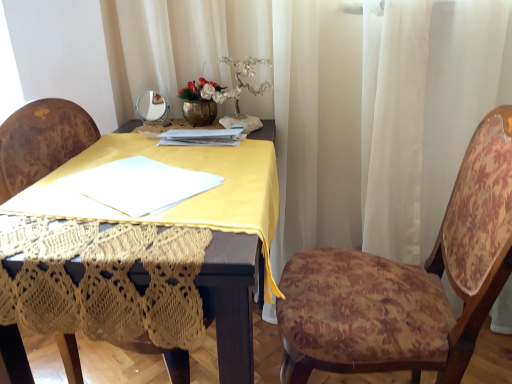
This screenshot has width=512, height=384. Describe the element at coordinates (341, 106) in the screenshot. I see `white sheer curtain at upper center` at that location.

How much space does velvet floral chair at center, positioned as the 1th chair in left-to-right order, occupy vertically?

velvet floral chair at center, positioned as the 1th chair in left-to-right order, is 88.99 centimeters in height.

Image resolution: width=512 pixels, height=384 pixels. I want to click on floral fabric chair at right, the 2th chair positioned from the left, so click(x=408, y=283).

Where is `white sheer curtain at upper center`? The width and height of the screenshot is (512, 384). white sheer curtain at upper center is located at coordinates (341, 106).

Is velvet floral chair at center, positioned as the 1th chair in left-to-right order, facing towards floral fabric chair at right, the 2th chair positioned from the left?

Yes, velvet floral chair at center, positioned as the 1th chair in left-to-right order, is turned towards floral fabric chair at right, the 2th chair positioned from the left.

From a real-world perspective, is velvet floral chair at center, arranged as the 2th chair when viewed from the right, physically below floral fabric chair at right, which is the 1th chair from right to left?

Yes, from a real-world perspective, velvet floral chair at center, arranged as the 2th chair when viewed from the right, is beneath floral fabric chair at right, which is the 1th chair from right to left.

Can you confirm if velvet floral chair at center, arranged as the 2th chair when viewed from the right, is positioned to the left of floral fabric chair at right, the 2th chair positioned from the left?

Indeed, velvet floral chair at center, arranged as the 2th chair when viewed from the right, is positioned on the left side of floral fabric chair at right, the 2th chair positioned from the left.

From the image's perspective, relative to floral fabric chair at right, the 2th chair positioned from the left, is velvet floral chair at center, positioned as the 1th chair in left-to-right order, above or below?

Clearly, from the image's perspective, velvet floral chair at center, positioned as the 1th chair in left-to-right order, is above floral fabric chair at right, the 2th chair positioned from the left.

Is floral fabric chair at right, the 2th chair positioned from the left, smaller than velvet floral chair at center, positioned as the 1th chair in left-to-right order?

No.

Is floral fabric chair at right, the 2th chair positioned from the left, taller than velvet floral chair at center, positioned as the 1th chair in left-to-right order?

No.

Is floral fabric chair at right, which is the 1th chair from right to left, at the right side of velvet floral chair at center, arranged as the 2th chair when viewed from the right?

Yes, floral fabric chair at right, which is the 1th chair from right to left, is to the right of velvet floral chair at center, arranged as the 2th chair when viewed from the right.

What's the angular difference between floral fabric chair at right, which is the 1th chair from right to left, and velvet floral chair at center, positioned as the 1th chair in left-to-right order,'s facing directions?

The angle between the facing direction of floral fabric chair at right, which is the 1th chair from right to left, and the facing direction of velvet floral chair at center, positioned as the 1th chair in left-to-right order, is 168 degrees.

From a real-world perspective, is floral fabric chair at right, the 2th chair positioned from the left, beneath white sheer curtain at upper center?

Yes.

Can you confirm if floral fabric chair at right, which is the 1th chair from right to left, is wider than white sheer curtain at upper center?

Indeed, floral fabric chair at right, which is the 1th chair from right to left, has a greater width compared to white sheer curtain at upper center.

Which object is further away from the camera taking this photo, floral fabric chair at right, the 2th chair positioned from the left, or white sheer curtain at upper center?

white sheer curtain at upper center.

Which of these two, floral fabric chair at right, which is the 1th chair from right to left, or white sheer curtain at upper center, is bigger?

white sheer curtain at upper center.

Is the position of white sheer curtain at upper center less distant than that of floral fabric chair at right, which is the 1th chair from right to left?

No.

Is point (184, 74) in front of point (366, 324)?

No.

From a real-world perspective, is white sheer curtain at upper center beneath floral fabric chair at right, the 2th chair positioned from the left?

No, from a real-world perspective, white sheer curtain at upper center is not under floral fabric chair at right, the 2th chair positioned from the left.

Considering the relative sizes of white sheer curtain at upper center and velvet floral chair at center, positioned as the 1th chair in left-to-right order, in the image provided, is white sheer curtain at upper center thinner than velvet floral chair at center, positioned as the 1th chair in left-to-right order,?

Indeed, white sheer curtain at upper center has a lesser width compared to velvet floral chair at center, positioned as the 1th chair in left-to-right order.

From a real-world perspective, relative to velvet floral chair at center, arranged as the 2th chair when viewed from the right, is white sheer curtain at upper center vertically above or below?

white sheer curtain at upper center is above velvet floral chair at center, arranged as the 2th chair when viewed from the right.

This screenshot has width=512, height=384. Identify the location of curtain behind the velvet floral chair at center, arranged as the 2th chair when viewed from the right. (341, 106).

Consider the image. Who is taller, white sheer curtain at upper center or velvet floral chair at center, positioned as the 1th chair in left-to-right order?

Standing taller between the two is white sheer curtain at upper center.

From the image's perspective, is velvet floral chair at center, arranged as the 2th chair when viewed from the right, positioned above or below white sheer curtain at upper center?

velvet floral chair at center, arranged as the 2th chair when viewed from the right, is situated lower than white sheer curtain at upper center in the image.

Can you tell me how much velvet floral chair at center, arranged as the 2th chair when viewed from the right, and white sheer curtain at upper center differ in facing direction?

74.6 degrees.

From a real-world perspective, who is located higher, velvet floral chair at center, arranged as the 2th chair when viewed from the right, or white sheer curtain at upper center?

From a 3D spatial view, white sheer curtain at upper center is above.

Based on the photo, is velvet floral chair at center, positioned as the 1th chair in left-to-right order, closer to camera compared to white sheer curtain at upper center?

Yes.

Where is `chair below the velvet floral chair at center, positioned as the 1th chair in left-to-right order (from the image's perspective)`? Image resolution: width=512 pixels, height=384 pixels. chair below the velvet floral chair at center, positioned as the 1th chair in left-to-right order (from the image's perspective) is located at coordinates (408, 283).

This screenshot has height=384, width=512. Find the location of `chair to the left of floral fabric chair at right, which is the 1th chair from right to left`. chair to the left of floral fabric chair at right, which is the 1th chair from right to left is located at coordinates (41, 141).

Considering their positions, is white sheer curtain at upper center positioned further to velvet floral chair at center, positioned as the 1th chair in left-to-right order, than floral fabric chair at right, the 2th chair positioned from the left?

floral fabric chair at right, the 2th chair positioned from the left.

Looking at the image, which one is located further to white sheer curtain at upper center, velvet floral chair at center, arranged as the 2th chair when viewed from the right, or floral fabric chair at right, which is the 1th chair from right to left?

Based on the image, velvet floral chair at center, arranged as the 2th chair when viewed from the right, appears to be further to white sheer curtain at upper center.

Estimate the real-world distances between objects in this image. Which object is closer to floral fabric chair at right, which is the 1th chair from right to left, white sheer curtain at upper center or velvet floral chair at center, arranged as the 2th chair when viewed from the right?

Based on the image, white sheer curtain at upper center appears to be nearer to floral fabric chair at right, which is the 1th chair from right to left.

Looking at this image, based on their spatial positions, is velvet floral chair at center, positioned as the 1th chair in left-to-right order, or white sheer curtain at upper center closer to floral fabric chair at right, which is the 1th chair from right to left?

white sheer curtain at upper center lies closer to floral fabric chair at right, which is the 1th chair from right to left, than the other object.

Estimate the real-world distances between objects in this image. Which object is closer to velvet floral chair at center, positioned as the 1th chair in left-to-right order, floral fabric chair at right, which is the 1th chair from right to left, or white sheer curtain at upper center?

white sheer curtain at upper center lies closer to velvet floral chair at center, positioned as the 1th chair in left-to-right order, than the other object.

Estimate the real-world distances between objects in this image. Which object is further from white sheer curtain at upper center, floral fabric chair at right, the 2th chair positioned from the left, or velvet floral chair at center, positioned as the 1th chair in left-to-right order?

velvet floral chair at center, positioned as the 1th chair in left-to-right order, is positioned further to the anchor white sheer curtain at upper center.

You are a GUI agent. You are given a task and a screenshot of the screen. Output one action in this format:
    pyautogui.click(x=<x>, y=<y>)
    Task: Click on the chair between velvet floral chair at center, positioned as the 1th chair in left-to-right order, and white sheer curtain at upper center from left to right
    The height and width of the screenshot is (384, 512).
    Given the screenshot: What is the action you would take?
    tap(408, 283)